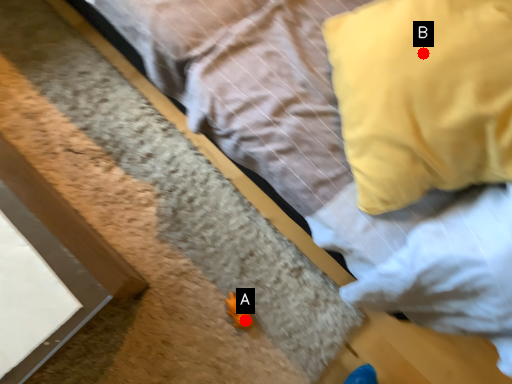
Question: Two points are circled on the image, labeled by A and B beside each circle. Which point appears closest to the camera in this image?

Choices:
 (A) A is closer
 (B) B is closer

Answer: (B)